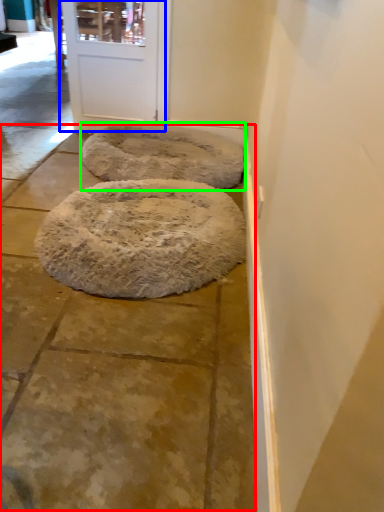
Question: Which is nearer to the pavement (highlighted by a red box)? door (highlighted by a blue box) or dog bed (highlighted by a green box).

Choices:
 (A) door
 (B) dog bed

Answer: (B)